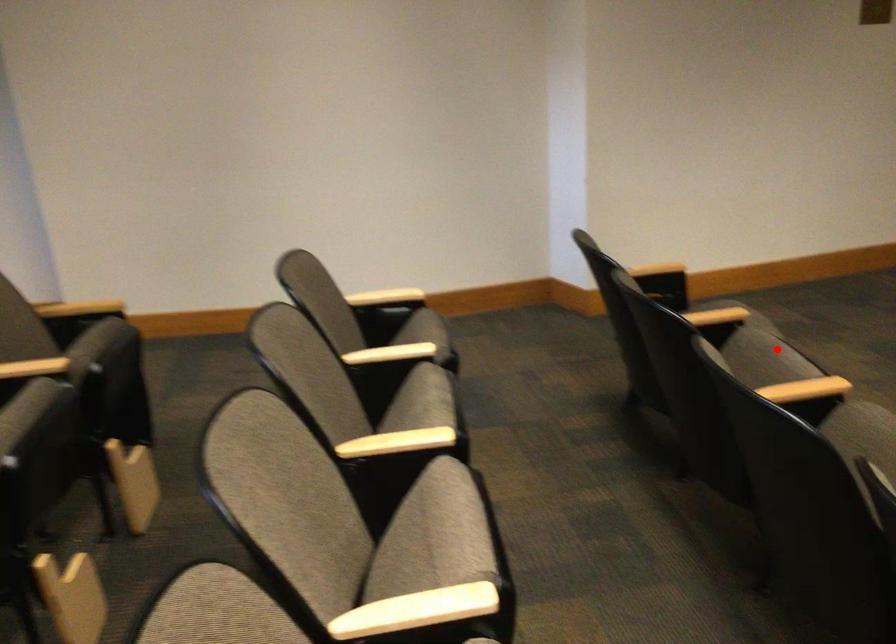
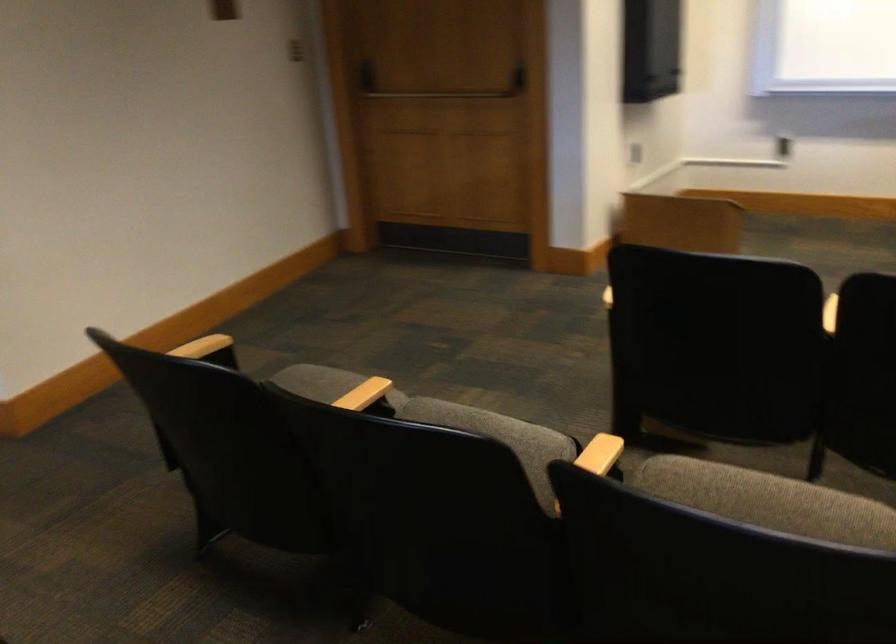
The point at the highlighted location is marked in the first image. Where is the corresponding point in the second image?

(490, 426)